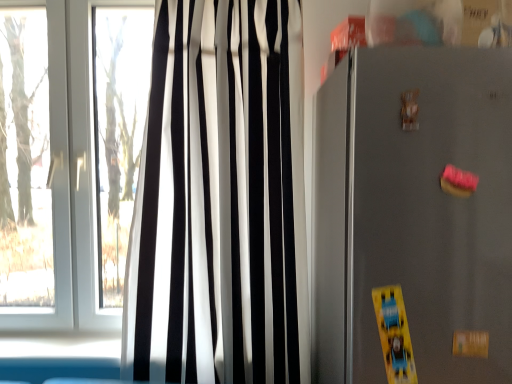
Question: From the image's perspective, relative to satin gray refrigerator at right, is black/white striped curtain at left above or below?

Choices:
 (A) below
 (B) above

Answer: (B)

Question: From a real-world perspective, is black/white striped curtain at left physically located above or below satin gray refrigerator at right?

Choices:
 (A) below
 (B) above

Answer: (B)

Question: Is black/white striped curtain at left wider or thinner than satin gray refrigerator at right?

Choices:
 (A) thin
 (B) wide

Answer: (A)

Question: Looking at the image, does satin gray refrigerator at right seem bigger or smaller compared to black/white striped curtain at left?

Choices:
 (A) small
 (B) big

Answer: (B)

Question: Is satin gray refrigerator at right in front of or behind black/white striped curtain at left in the image?

Choices:
 (A) behind
 (B) front

Answer: (B)

Question: In the image, is satin gray refrigerator at right on the left side or the right side of black/white striped curtain at left?

Choices:
 (A) right
 (B) left

Answer: (A)

Question: Would you say satin gray refrigerator at right is inside or outside black/white striped curtain at left?

Choices:
 (A) inside
 (B) outside

Answer: (B)